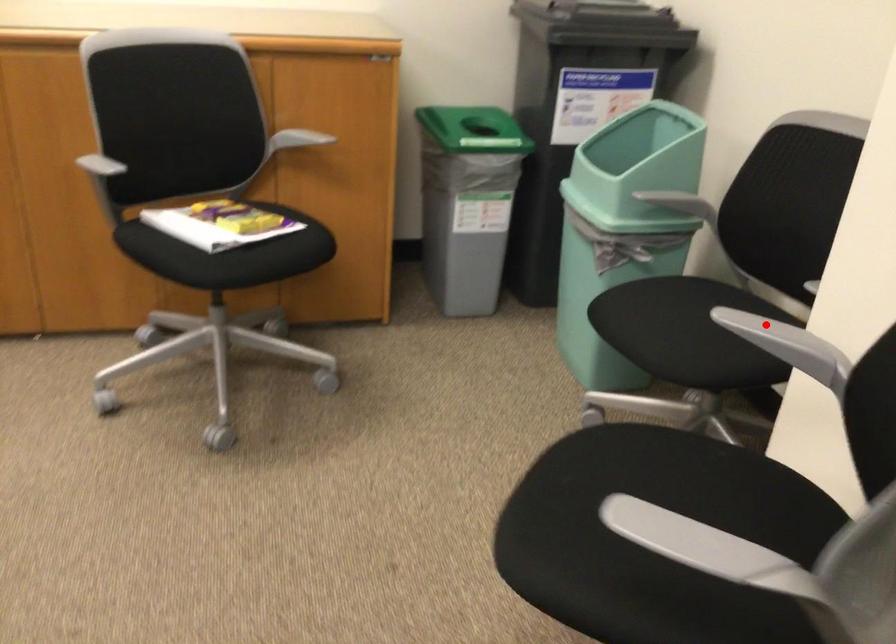
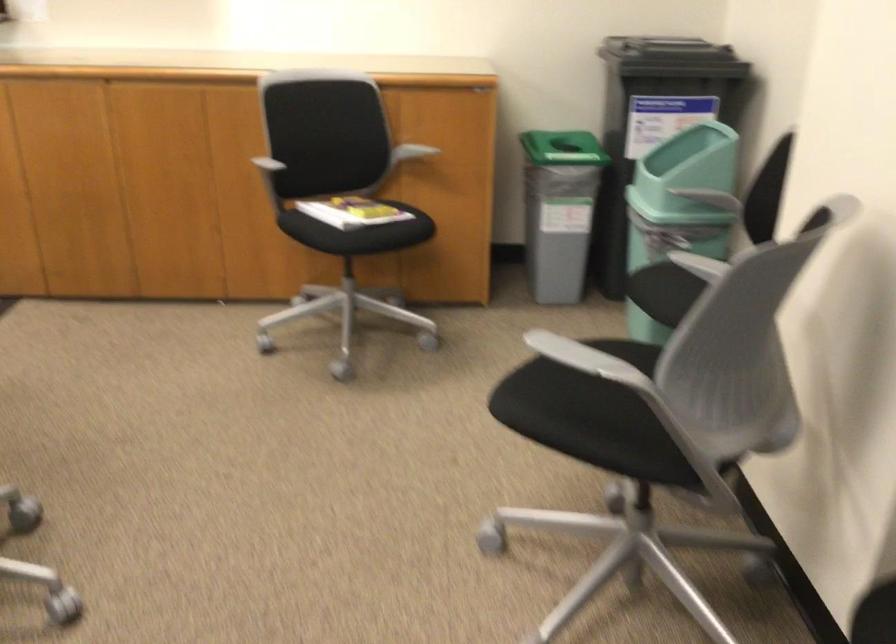
Question: I am providing you with two images of the same scene from different viewpoints. A red point is shown in image1. For the corresponding object point in image2, is it positioned nearer or farther from the camera?

Choices:
 (A) Nearer
 (B) Farther

Answer: (B)